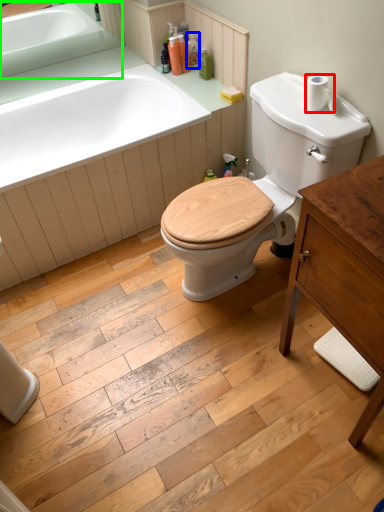
Question: Which object is the farthest from toilet paper (highlighted by a red box)? Choose among these: toiletry (highlighted by a blue box) or sink (highlighted by a green box).

Choices:
 (A) toiletry
 (B) sink

Answer: (B)